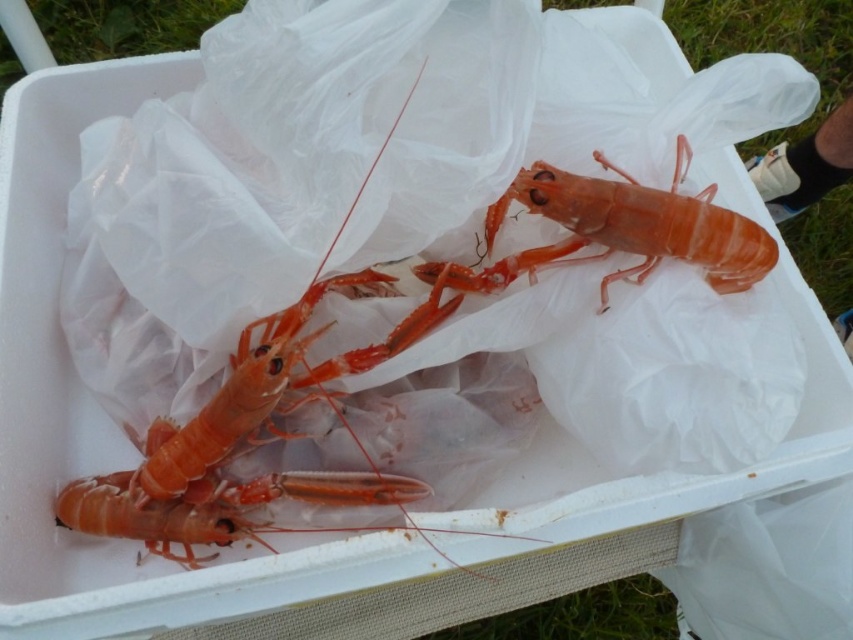
Is shiny orange lobster at center above translucent orange lobster at center?

Actually, shiny orange lobster at center is below translucent orange lobster at center.

Measure the distance between shiny orange lobster at center and camera.

shiny orange lobster at center is 64.46 centimeters from camera.

Between point (316, 337) and point (625, 188), which one is positioned in front?

Point (625, 188) is more forward.

Where is `shiny orange lobster at center`? This screenshot has height=640, width=853. shiny orange lobster at center is located at coordinates (227, 410).